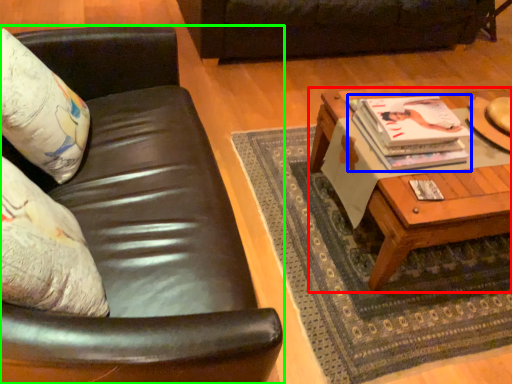
Question: Which is farther away from coffee table (highlighted by a red box)? magazine (highlighted by a blue box) or studio couch (highlighted by a green box)?

Choices:
 (A) magazine
 (B) studio couch

Answer: (B)